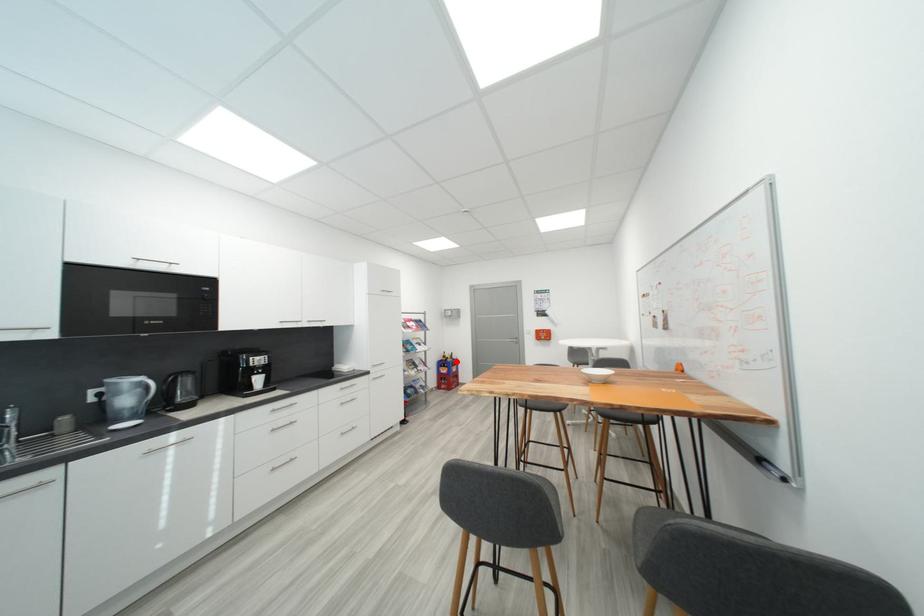
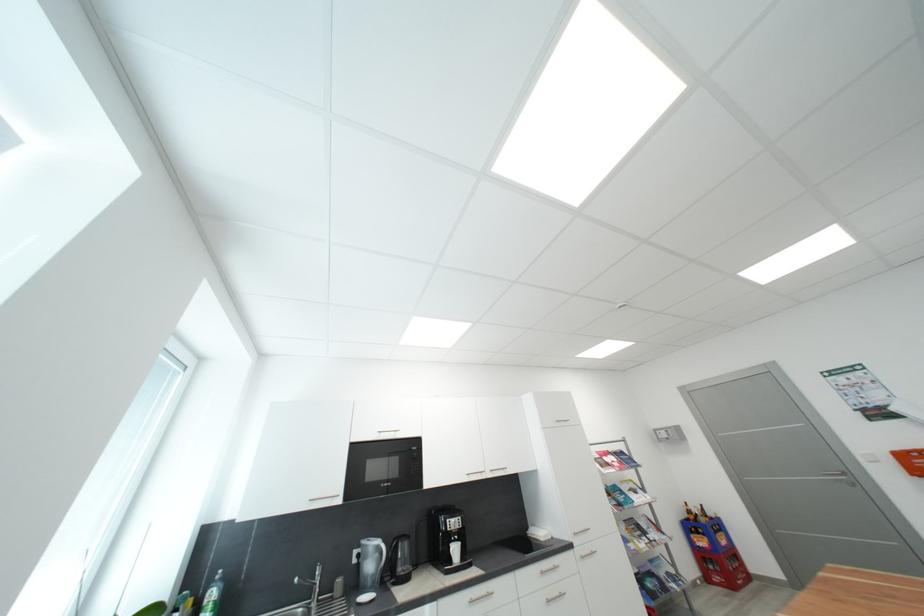
In the second image, find the point that corresponds to the highlighted location in the first image.

(710, 522)